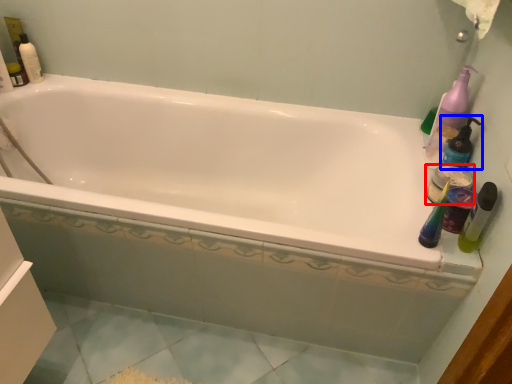
Question: Which of the following is the farthest to the observer, mouthwash (highlighted by a red box) or cleaning product (highlighted by a blue box)?

Choices:
 (A) mouthwash
 (B) cleaning product

Answer: (A)